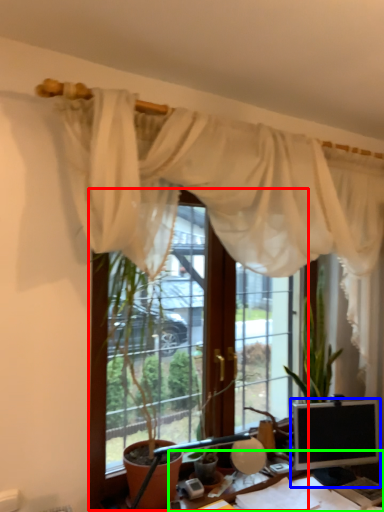
Question: Which object is the farthest from window (highlighted by a red box)? Choose among these: computer monitor (highlighted by a blue box) or desk (highlighted by a green box).

Choices:
 (A) computer monitor
 (B) desk

Answer: (A)